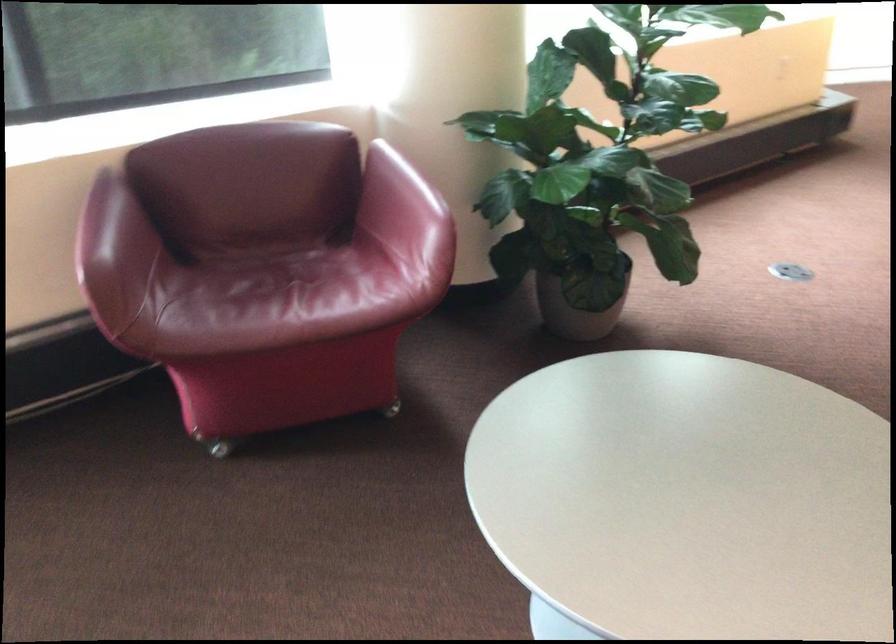
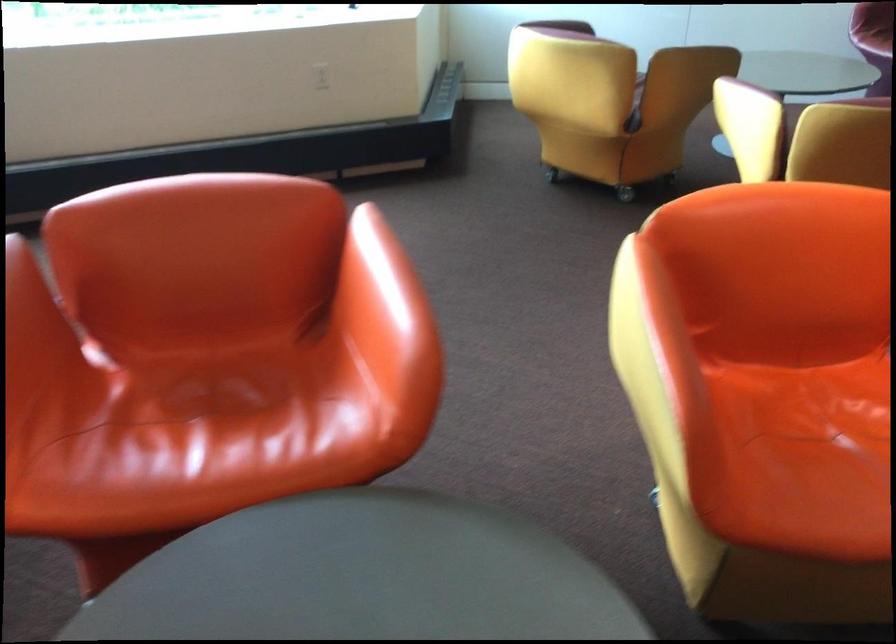
Question: Which direction would the cameraman need to move to produce the second image? Reply with the corresponding letter.

Choices:
 (A) Left
 (B) Right
 (C) Forward
 (D) Backward

Answer: (B)